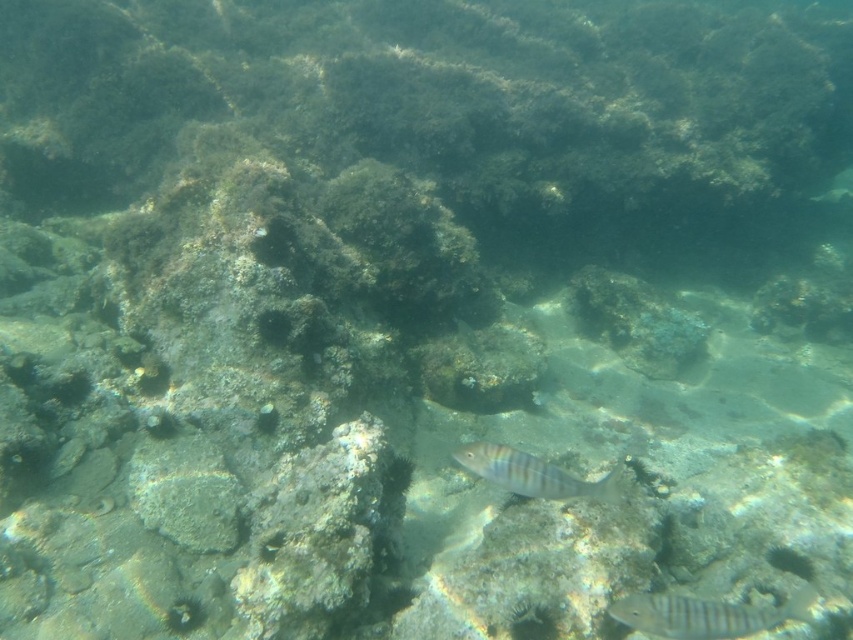
Question: Which of the following is the closest to the observer?

Choices:
 (A) striped silver fish at center
 (B) shiny silver fish at center

Answer: (A)

Question: Which object is farther from the camera taking this photo?

Choices:
 (A) shiny silver fish at center
 (B) striped silver fish at center

Answer: (A)

Question: Is striped silver fish at center below shiny silver fish at center?

Choices:
 (A) no
 (B) yes

Answer: (B)

Question: Is striped silver fish at center positioned before shiny silver fish at center?

Choices:
 (A) no
 (B) yes

Answer: (B)

Question: Is striped silver fish at center bigger than shiny silver fish at center?

Choices:
 (A) yes
 (B) no

Answer: (A)